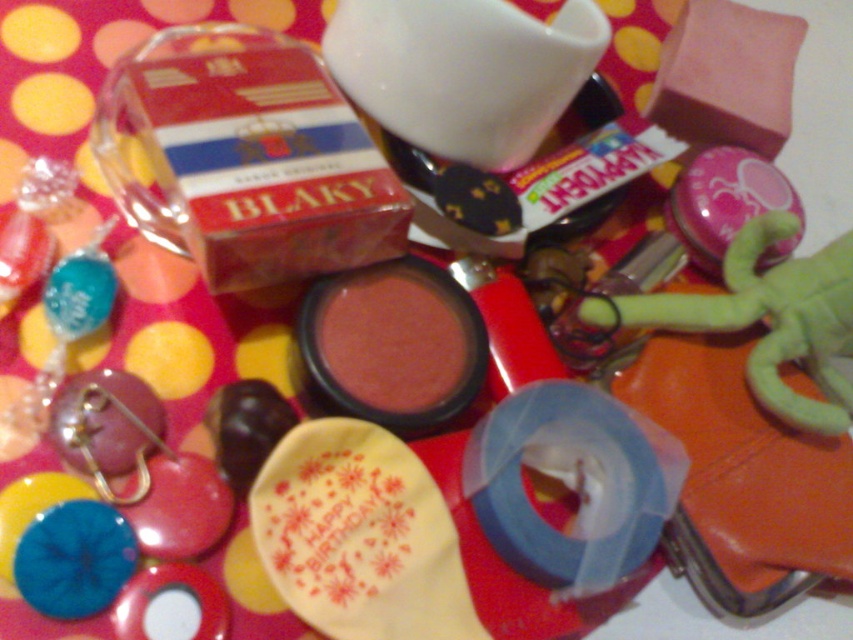
Question: Observing the image, what is the correct spatial positioning of green plush toy at lower right in reference to blue rubber band at lower left?

Choices:
 (A) right
 (B) left

Answer: (A)

Question: Can you confirm if green plush toy at lower right is smaller than blue rubber band at lower left?

Choices:
 (A) yes
 (B) no

Answer: (B)

Question: Can you confirm if green plush toy at lower right is smaller than blue rubber band at lower left?

Choices:
 (A) no
 (B) yes

Answer: (A)

Question: Which point is farther to the camera?

Choices:
 (A) blue rubber band at lower left
 (B) green plush toy at lower right

Answer: (B)